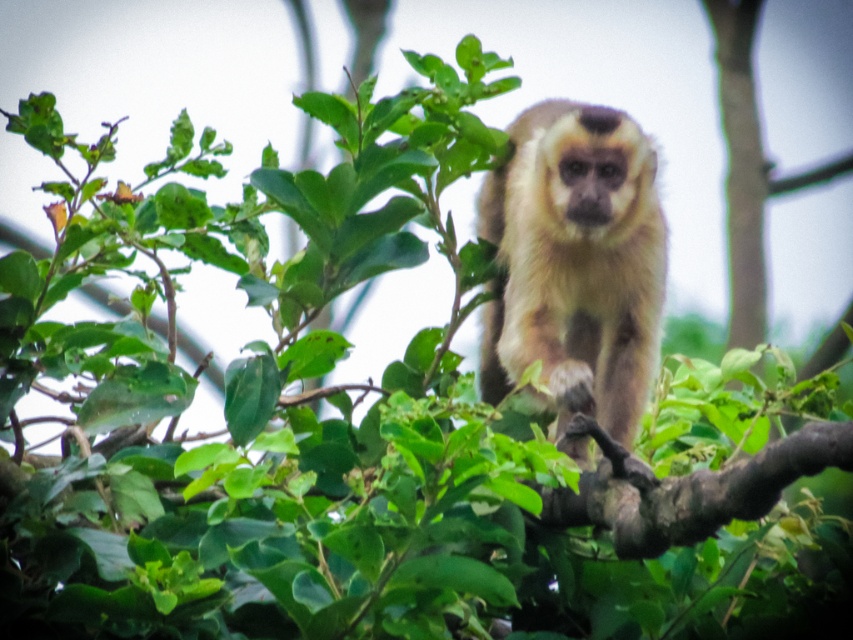
You are standing in a forest and see a fuzzy beige monkey at center sitting on a tree branch. If you want to throw a banana to the monkey, and the banana can travel 3 meters, will it reach the monkey?

The fuzzy beige monkey at center is 3.19 meters away from the viewer. Since the banana can only travel 3 meters, it won not reach the monkey.

You are a wildlife photographer aiming to capture a closeup of the fuzzy beige monkey at center. To do so, you need to adjust your camera focus. Since the brown rough tree branch at center is in the way, will you have to focus your camera upwards or downwards to get a clear shot of the monkey?

The fuzzy beige monkey at center is above the brown rough tree branch at center, so you will need to focus your camera upwards to get a clear shot of the monkey.

In the scene shown: You are a wildlife photographer aiming to capture the fuzzy beige monkey at center sitting on the brown rough tree branch at center. Based on their sizes, will the monkey be entirely visible in the frame if the branch is positioned at the bottom of the image?

The fuzzy beige monkey at center is taller than the brown rough tree branch at center, so if the branch is at the bottom of the frame, part of the monkey might be cut off since it is larger in height compared to the branch.